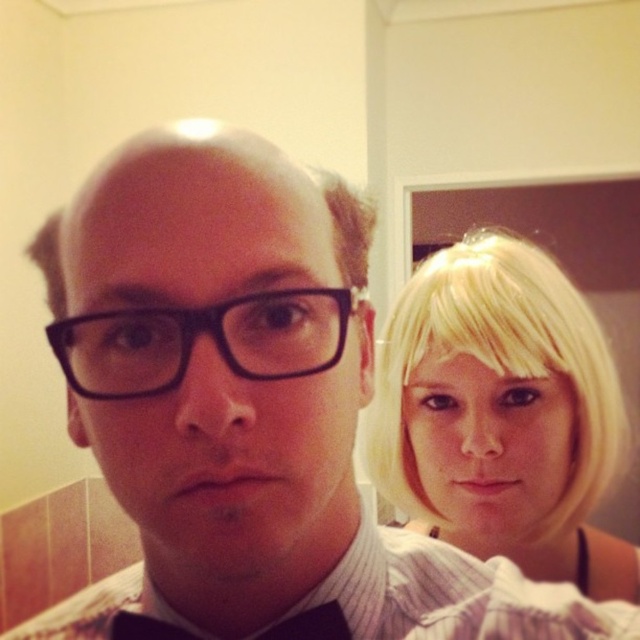
What do you see at coordinates (500, 413) in the screenshot? The width and height of the screenshot is (640, 640). I see `blonde hair at upper right` at bounding box center [500, 413].

Who is positioned more to the left, blonde hair at upper right or matte black bow tie at lower center?

From the viewer's perspective, matte black bow tie at lower center appears more on the left side.

Who is more distant from viewer, (435, 504) or (115, 621)?

Point (435, 504)

This screenshot has height=640, width=640. Find the location of `blonde hair at upper right`. blonde hair at upper right is located at coordinates (500, 413).

Who is more forward, (204, 324) or (308, 624)?

Positioned in front is point (204, 324).

Is point (180, 336) positioned after point (129, 636)?

That is False.

You are a GUI agent. You are given a task and a screenshot of the screen. Output one action in this format:
    pyautogui.click(x=<x>, y=<y>)
    Task: Click on the black plastic glasses at center
    This screenshot has width=640, height=640.
    Given the screenshot: What is the action you would take?
    pyautogui.click(x=196, y=336)

Between blonde hair at upper right and black plastic glasses at center, which one has more height?

With more height is blonde hair at upper right.

How distant is blonde hair at upper right from black plastic glasses at center?

blonde hair at upper right and black plastic glasses at center are 18.24 inches apart.

Who is more forward, [436,460] or [118,355]?

Point [118,355] is more forward.

You are a GUI agent. You are given a task and a screenshot of the screen. Output one action in this format:
    pyautogui.click(x=<x>, y=<y>)
    Task: Click on the blonde hair at upper right
    
    Given the screenshot: What is the action you would take?
    pyautogui.click(x=500, y=413)